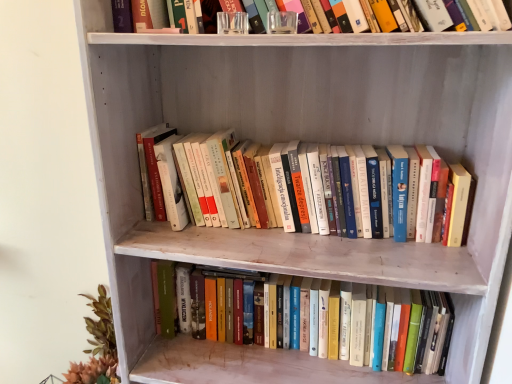
Question: Would you say hardcover books at center, the 2th book ordered from the bottom, is inside or outside hardcover books at center, which is the first book in bottom-to-top order?

Choices:
 (A) outside
 (B) inside

Answer: (A)

Question: Considering the positions of hardcover books at center, the 1th book in the top-to-bottom sequence, and hardcover books at center, which is the first book in bottom-to-top order, in the image, is hardcover books at center, the 1th book in the top-to-bottom sequence, taller or shorter than hardcover books at center, which is the first book in bottom-to-top order,?

Choices:
 (A) short
 (B) tall

Answer: (A)

Question: In the image, is hardcover books at center, the 1th book in the top-to-bottom sequence, positioned in front of or behind hardcover books at center, the 2th book in the top-to-bottom sequence?

Choices:
 (A) front
 (B) behind

Answer: (A)

Question: Is point (274, 332) positioned closer to the camera than point (263, 155)?

Choices:
 (A) closer
 (B) farther

Answer: (B)

Question: Looking at their shapes, would you say hardcover books at center, the 2th book in the top-to-bottom sequence, is wider or thinner than hardcover books at center, the 1th book in the top-to-bottom sequence?

Choices:
 (A) wide
 (B) thin

Answer: (B)

Question: From a real-world perspective, is hardcover books at center, which is the first book in bottom-to-top order, above or below hardcover books at center, the 1th book in the top-to-bottom sequence?

Choices:
 (A) below
 (B) above

Answer: (A)

Question: Is hardcover books at center, which is the first book in bottom-to-top order, in front of or behind hardcover books at center, the 2th book ordered from the bottom, in the image?

Choices:
 (A) front
 (B) behind

Answer: (B)